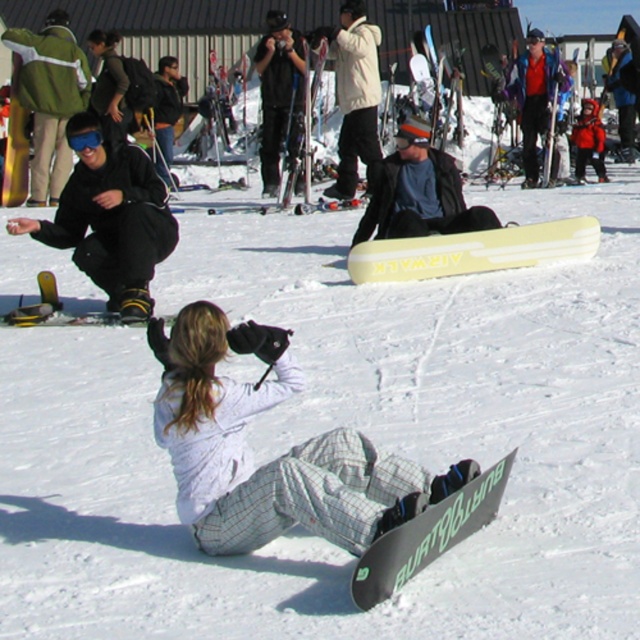
Is the position of yellow matte snowboard at center more distant than that of black matte goggles at upper left?

Yes, it is.

Does yellow matte snowboard at center have a larger size compared to black matte goggles at upper left?

Indeed, yellow matte snowboard at center has a larger size compared to black matte goggles at upper left.

Image resolution: width=640 pixels, height=640 pixels. What do you see at coordinates (474, 250) in the screenshot? I see `yellow matte snowboard at center` at bounding box center [474, 250].

What are the coordinates of `yellow matte snowboard at center` in the screenshot? It's located at (474, 250).

Which is below, matte black snowboard at left or black matte snowboard at lower center?

Positioned lower is black matte snowboard at lower center.

Is point (145, 232) closer to camera compared to point (476, 513)?

No, it is behind (476, 513).

Is point (109, 273) positioned before point (502, 465)?

No.

Identify the location of matte black snowboard at left. (112, 225).

Is point (536, 230) farther from viewer compared to point (484, 474)?

Yes, point (536, 230) is behind point (484, 474).

I want to click on yellow matte snowboard at center, so click(x=474, y=250).

Locate an element on the screen. The image size is (640, 640). yellow matte snowboard at center is located at coordinates (474, 250).